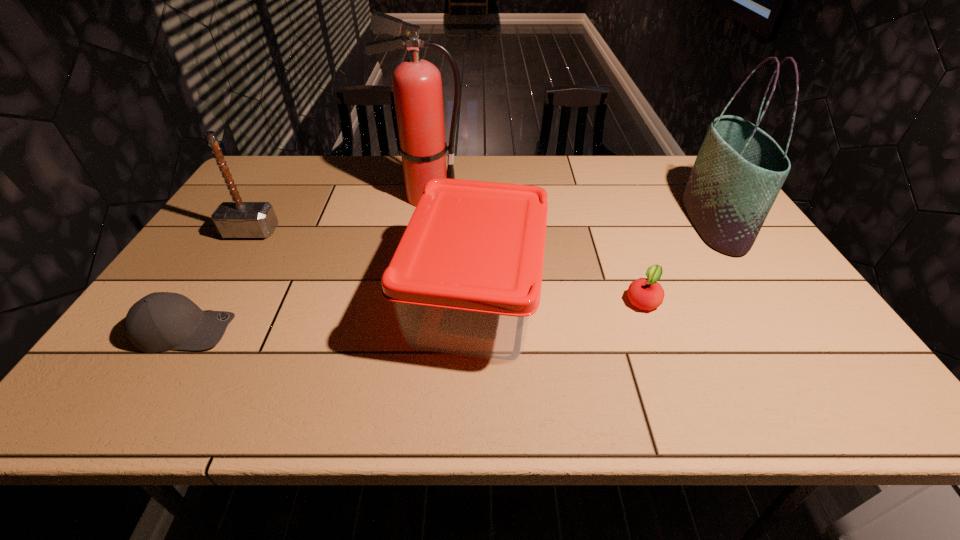
The width and height of the screenshot is (960, 540). Identify the location of vacant region that satisfies the following two spatial constraints: 1. on the hose direction of the fire extinguisher; 2. on the right side of the rightmost object. (421, 223).

Identify the location of blank space that satisfies the following two spatial constraints: 1. on the hose direction of the third shortest object; 2. on the left side of the fire extinguisher. This screenshot has width=960, height=540. (409, 300).

This screenshot has height=540, width=960. I want to click on vacant point that satisfies the following two spatial constraints: 1. on the striking surface of the fourth shortest object; 2. on the right side of the tray, so click(x=209, y=300).

Where is `free space that satisfies the following two spatial constraints: 1. on the back side of the tote bag; 2. on the right side of the third shortest object`? The height and width of the screenshot is (540, 960). free space that satisfies the following two spatial constraints: 1. on the back side of the tote bag; 2. on the right side of the third shortest object is located at coordinates (475, 223).

The height and width of the screenshot is (540, 960). I want to click on vacant position in the image that satisfies the following two spatial constraints: 1. on the striking surface of the fourth shortest object; 2. on the left side of the apple, so click(209, 300).

Identify the location of free space that satisfies the following two spatial constraints: 1. on the hose direction of the apple; 2. on the right side of the fire extinguisher. This screenshot has height=540, width=960. (409, 300).

In order to click on free location that satisfies the following two spatial constraints: 1. on the hose direction of the fire extinguisher; 2. on the right side of the tray in this screenshot , I will do `click(409, 300)`.

The width and height of the screenshot is (960, 540). What are the coordinates of `vacant space that satisfies the following two spatial constraints: 1. on the hose direction of the tote bag; 2. on the left side of the fire extinguisher` in the screenshot? It's located at (421, 223).

Where is `free region that satisfies the following two spatial constraints: 1. on the hose direction of the fire extinguisher; 2. on the striking surface of the third tallest object`? Image resolution: width=960 pixels, height=540 pixels. free region that satisfies the following two spatial constraints: 1. on the hose direction of the fire extinguisher; 2. on the striking surface of the third tallest object is located at coordinates click(420, 232).